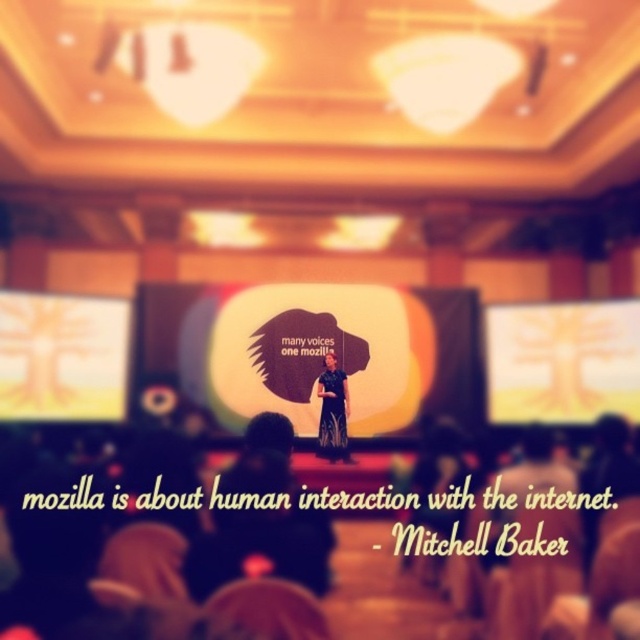
Is white matte projection screen at center shorter than black satin dress at center?

Incorrect, white matte projection screen at center's height does not fall short of black satin dress at center's.

Who is more distant from viewer, (220, 378) or (342, 403)?

Point (220, 378)

The width and height of the screenshot is (640, 640). Find the location of `white matte projection screen at center`. white matte projection screen at center is located at coordinates (308, 353).

Image resolution: width=640 pixels, height=640 pixels. Identify the location of white matte projection screen at center. (308, 353).

Which of these two, white matte projection screen at center or yellow matte projection screen at upper left, stands shorter?

Standing shorter between the two is yellow matte projection screen at upper left.

Who is positioned more to the left, white matte projection screen at center or yellow matte projection screen at upper left?

yellow matte projection screen at upper left is more to the left.

Measure the distance between white matte projection screen at center and camera.

white matte projection screen at center and camera are 11.12 meters apart.

This screenshot has height=640, width=640. Find the location of `white matte projection screen at center`. white matte projection screen at center is located at coordinates (308, 353).

The image size is (640, 640). Find the location of `yellow matte projection screen at upper center`. yellow matte projection screen at upper center is located at coordinates (563, 360).

Which is more to the right, yellow matte projection screen at upper center or black satin dress at center?

yellow matte projection screen at upper center is more to the right.

Is point (520, 376) closer to camera compared to point (330, 436)?

No, it is behind (330, 436).

Locate an element on the screen. yellow matte projection screen at upper center is located at coordinates (563, 360).